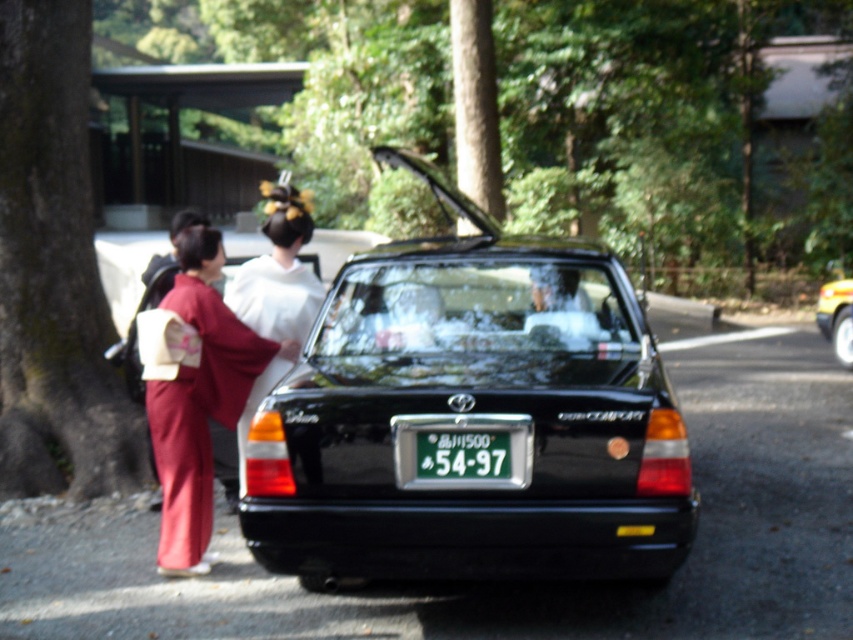
Is black glossy sedan at center above metallic gold car at center?

Yes.

Between point (315, 324) and point (834, 342), which one is positioned behind?

The point (834, 342) is more distant.

The image size is (853, 640). I want to click on black glossy sedan at center, so click(x=469, y=413).

Which is more to the left, smooth bark tree at left or white silk kimono at center?

From the viewer's perspective, smooth bark tree at left appears more on the left side.

Consider the image. Between smooth bark tree at left and white silk kimono at center, which one has less height?

white silk kimono at center

What are the coordinates of `smooth bark tree at left` in the screenshot? It's located at (54, 272).

This screenshot has height=640, width=853. Find the location of `smooth bark tree at left`. smooth bark tree at left is located at coordinates (54, 272).

Does smooth bark tree at left appear over metallic gold car at center?

Yes.

Is smooth bark tree at left shorter than metallic gold car at center?

No, smooth bark tree at left is not shorter than metallic gold car at center.

Between point (77, 326) and point (840, 358), which one is positioned in front?

Positioned in front is point (77, 326).

Locate an element on the screen. smooth bark tree at left is located at coordinates (54, 272).